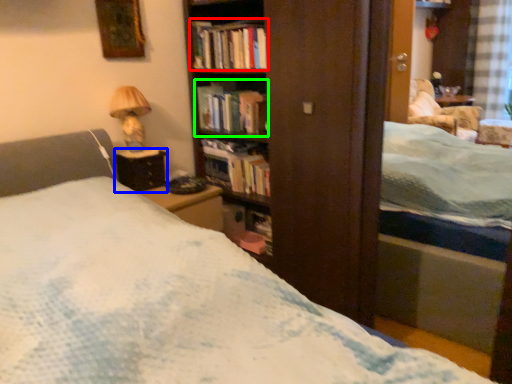
Question: Based on their relative distances, which object is farther from book (highlighted by a red box)? Choose from table (highlighted by a blue box) and book (highlighted by a green box).

Choices:
 (A) table
 (B) book

Answer: (A)